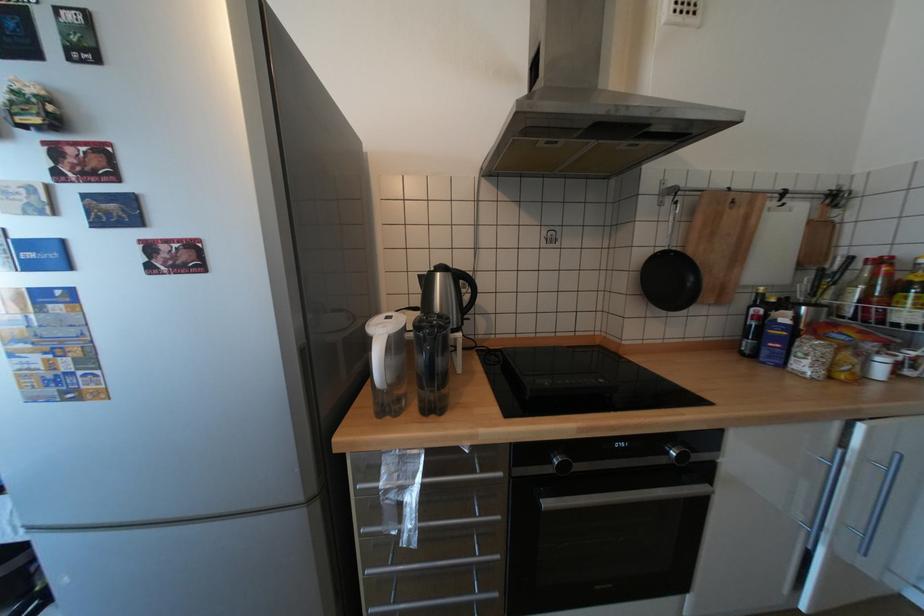
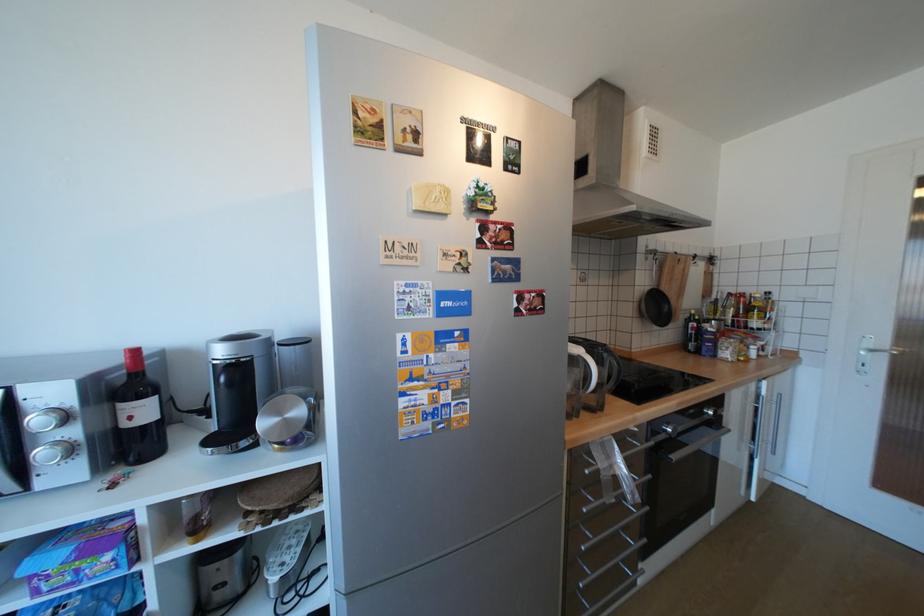
In the second image, find the point that corresponds to point (699, 252) in the first image.

(672, 290)